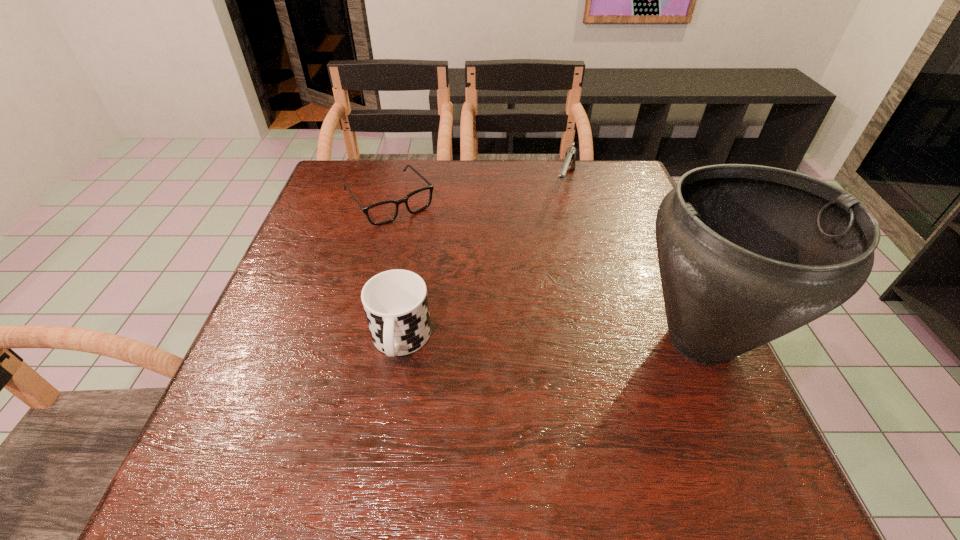
I want to click on vacant space located 0.090m aiming along the barrel of the gun, so click(560, 226).

Where is `vacant position located 0.080m aiming along the barrel of the gun`? vacant position located 0.080m aiming along the barrel of the gun is located at coordinates (560, 224).

The image size is (960, 540). I want to click on spectacles at the far edge, so click(384, 212).

The width and height of the screenshot is (960, 540). I want to click on gun that is at the far edge, so click(569, 162).

You are a GUI agent. You are given a task and a screenshot of the screen. Output one action in this format:
    pyautogui.click(x=<x>, y=<y>)
    Task: Click on the object present at the near edge
    This screenshot has width=960, height=540.
    Given the screenshot: What is the action you would take?
    pyautogui.click(x=747, y=254)

Where is `object present at the left edge`? Image resolution: width=960 pixels, height=540 pixels. object present at the left edge is located at coordinates (384, 212).

Identify the location of urn at the right edge. (747, 254).

Locate an element on the screen. The height and width of the screenshot is (540, 960). gun at the right edge is located at coordinates [569, 162].

Identify the location of object that is at the far left corner. The height and width of the screenshot is (540, 960). (384, 212).

Where is `object that is at the far right corner`? The image size is (960, 540). object that is at the far right corner is located at coordinates (569, 162).